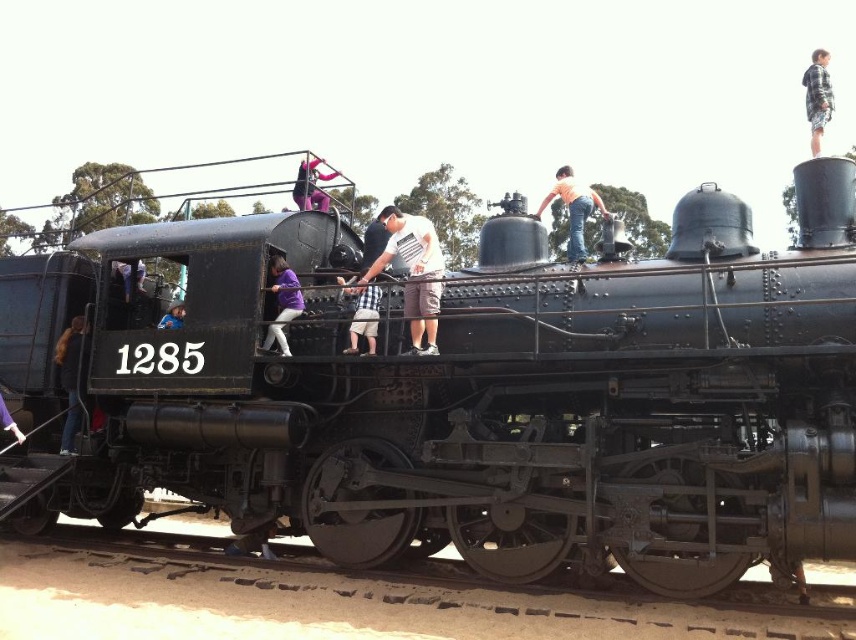
You are a photographer trying to capture a clear shot of both the purple matte shirt at center and the purple fabric pants at lower left. However, you notice that one is blocking the other. Which one is obstructing the view of the other?

The purple matte shirt at center is in front of the purple fabric pants at lower left, so it is obstructing the view of the purple fabric pants at lower left.